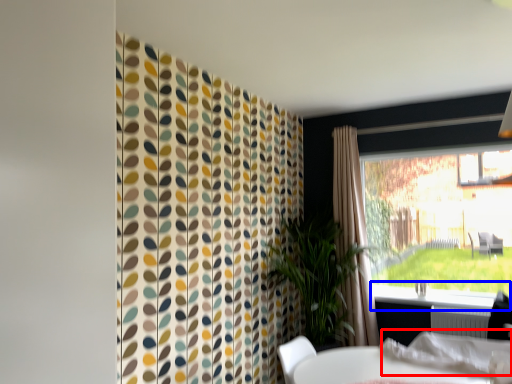
Question: Which of the following is the closest to the observer, linen (highlighted by a red box) or window sill (highlighted by a blue box)?

Choices:
 (A) linen
 (B) window sill

Answer: (A)